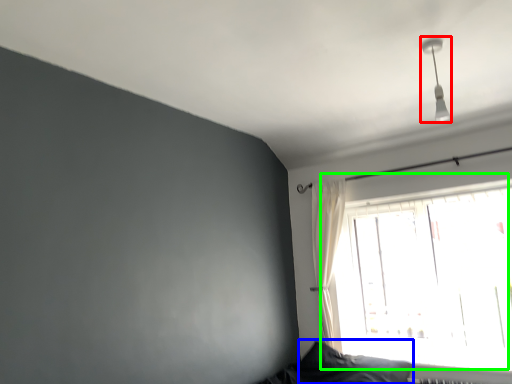
Question: Which object is the farthest from fixture (highlighted by a red box)? Choose among these: pillow (highlighted by a blue box) or window (highlighted by a green box).

Choices:
 (A) pillow
 (B) window

Answer: (A)